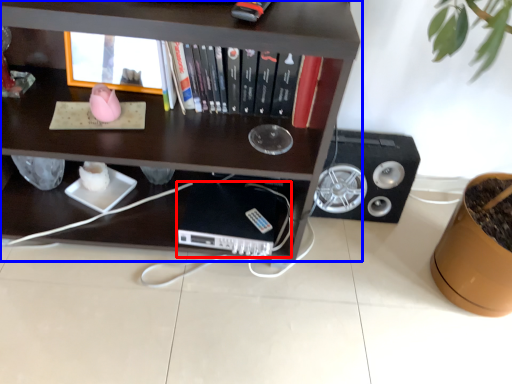
Question: Which object is closer to the camera taking this photo, computer (highlighted by a red box) or shelf (highlighted by a blue box)?

Choices:
 (A) computer
 (B) shelf

Answer: (B)